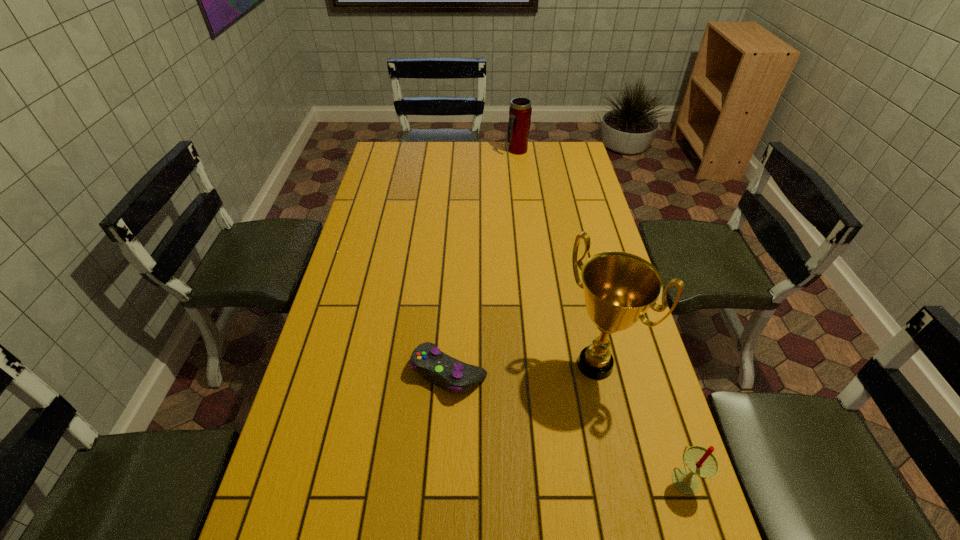
Find the location of a particular element. The width and height of the screenshot is (960, 540). free spot at the right edge of the desktop is located at coordinates (691, 496).

In the image, there is a desktop. At what (x,y) coordinates should I click in order to perform the action: click on vacant space at the near right corner. Please return your answer as a coordinate pair (x, y). Looking at the image, I should click on tap(684, 522).

Where is `blank region between the tallest object and the farthest object`? blank region between the tallest object and the farthest object is located at coordinates (556, 258).

Locate an element on the screen. The image size is (960, 540). free spot between the thermos bottle and the tallest object is located at coordinates (556, 258).

The image size is (960, 540). In order to click on free space between the control and the farthest object in this screenshot , I will do `click(483, 261)`.

Locate an element on the screen. The image size is (960, 540). free space between the farthest object and the shortest object is located at coordinates (483, 261).

Identify the location of free space between the leftmost object and the farthest object. The width and height of the screenshot is (960, 540). (483, 261).

Choose which object is the nearest neighbor to the second tallest object. Please provide its 2D coordinates. Your answer should be formatted as a tuple, i.e. [(x, y)], where the tuple contains the x and y coordinates of a point satisfying the conditions above.

[(619, 287)]

Where is `object that stands as the second closest to the second tallest object`? object that stands as the second closest to the second tallest object is located at coordinates (446, 372).